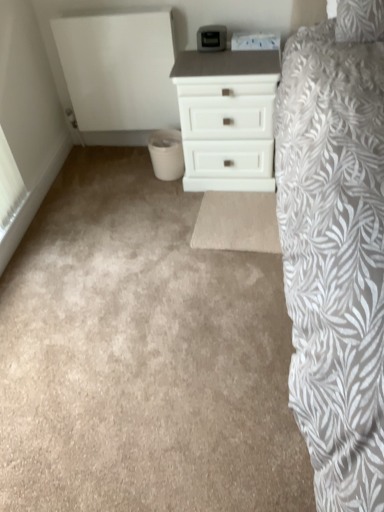
Question: From a real-world perspective, is white matte chest of drawers at center positioned over beige carpet at center based on gravity?

Choices:
 (A) no
 (B) yes

Answer: (B)

Question: From a real-world perspective, is white matte chest of drawers at center under beige carpet at center?

Choices:
 (A) no
 (B) yes

Answer: (A)

Question: Can you confirm if white matte chest of drawers at center is taller than beige carpet at center?

Choices:
 (A) no
 (B) yes

Answer: (B)

Question: Considering the relative positions of white matte chest of drawers at center and beige carpet at center in the image provided, is white matte chest of drawers at center behind beige carpet at center?

Choices:
 (A) yes
 (B) no

Answer: (A)

Question: From the image's perspective, would you say white matte chest of drawers at center is shown under beige carpet at center?

Choices:
 (A) no
 (B) yes

Answer: (A)

Question: Is white matte chest of drawers at center outside of beige carpet at center?

Choices:
 (A) yes
 (B) no

Answer: (A)

Question: Does beige carpet at center touch white matte chest of drawers at center?

Choices:
 (A) yes
 (B) no

Answer: (B)

Question: Can you confirm if beige carpet at center is smaller than white matte chest of drawers at center?

Choices:
 (A) no
 (B) yes

Answer: (A)

Question: Does beige carpet at center have a greater width compared to white matte chest of drawers at center?

Choices:
 (A) yes
 (B) no

Answer: (A)

Question: Is white matte chest of drawers at center located within beige carpet at center?

Choices:
 (A) yes
 (B) no

Answer: (B)

Question: From the image's perspective, is beige carpet at center on top of white matte chest of drawers at center?

Choices:
 (A) yes
 (B) no

Answer: (B)

Question: Is beige carpet at center further to the viewer compared to white matte chest of drawers at center?

Choices:
 (A) no
 (B) yes

Answer: (A)

Question: Is beige carpet at center taller or shorter than white matte chest of drawers at center?

Choices:
 (A) tall
 (B) short

Answer: (B)